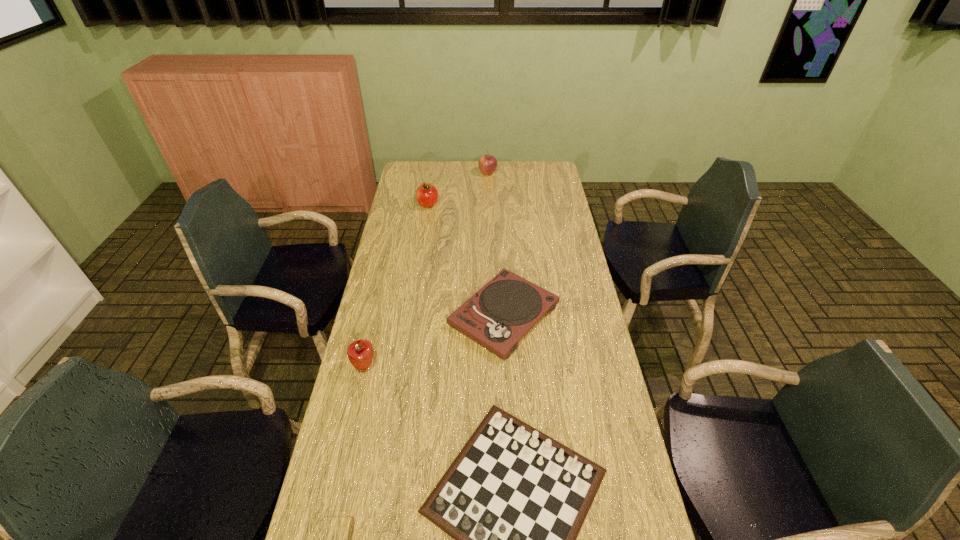
Where is `object at the far edge`? This screenshot has height=540, width=960. object at the far edge is located at coordinates (487, 164).

Locate an element on the screen. object situated at the right edge is located at coordinates (497, 316).

I want to click on free space at the far edge of the desktop, so click(x=516, y=181).

The height and width of the screenshot is (540, 960). In order to click on free space at the left edge of the desktop in this screenshot , I will do `click(409, 314)`.

Where is `blank space at the right edge of the desktop`? The height and width of the screenshot is (540, 960). blank space at the right edge of the desktop is located at coordinates (570, 312).

I want to click on vacant space at the far left corner of the desktop, so pos(407,178).

This screenshot has height=540, width=960. In order to click on vacant area at the far right corner in this screenshot , I will do `click(551, 166)`.

Locate an element on the screen. This screenshot has height=540, width=960. vacant space in between the farthest apple and the phonograph_record is located at coordinates (496, 244).

Locate an element on the screen. This screenshot has height=540, width=960. free area in between the second farthest object and the nearest apple is located at coordinates (x=396, y=285).

Image resolution: width=960 pixels, height=540 pixels. In order to click on empty space that is in between the farthest apple and the leftmost apple in this screenshot , I will do `click(426, 269)`.